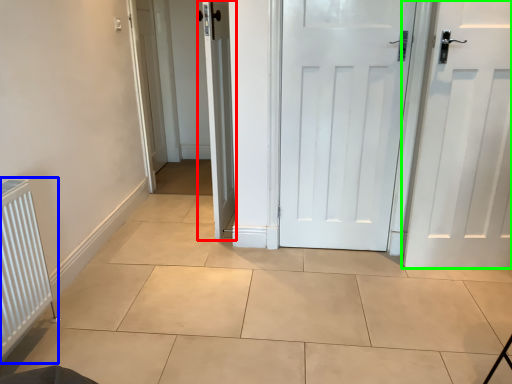
Question: Based on their relative distances, which object is nearer to door (highlighted by a red box)? Choose from radiator (highlighted by a blue box) and door (highlighted by a green box).

Choices:
 (A) radiator
 (B) door

Answer: (A)